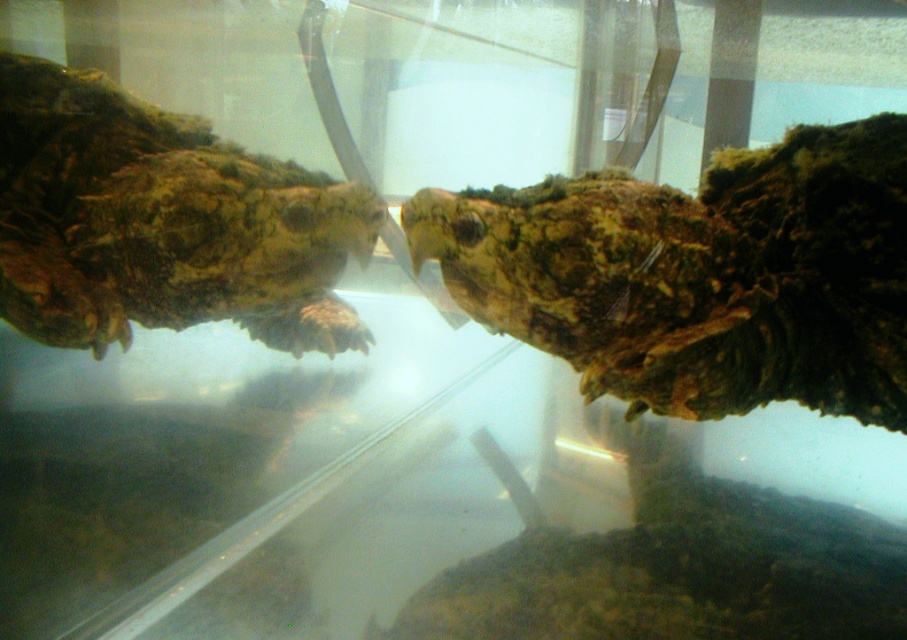
Can you confirm if textured brown reptile at center is wider than green mossy turtle head at left?

Yes, textured brown reptile at center is wider than green mossy turtle head at left.

Locate an element on the screen. textured brown reptile at center is located at coordinates (700, 275).

Locate an element on the screen. The width and height of the screenshot is (907, 640). textured brown reptile at center is located at coordinates (700, 275).